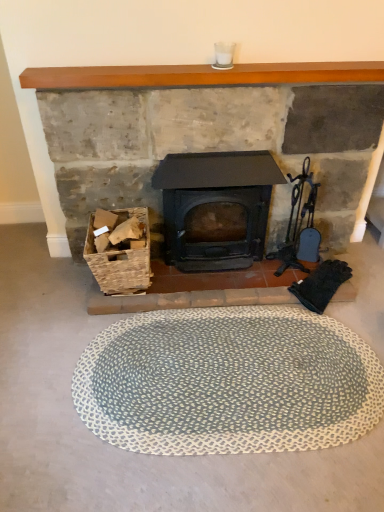
This screenshot has width=384, height=512. I want to click on vacant point to the right of woven wood basket at lower left, so click(184, 297).